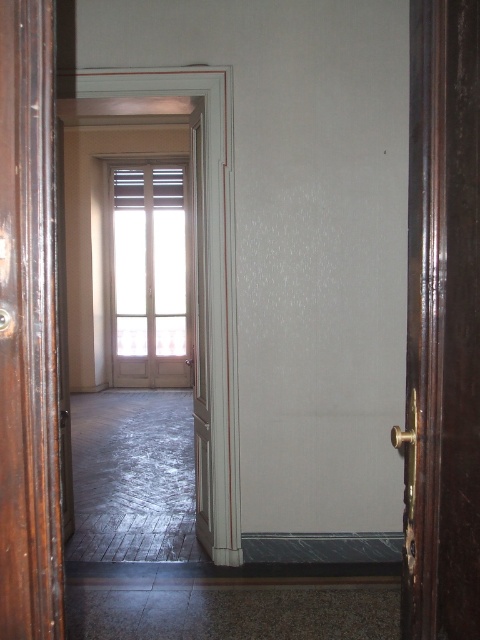
Does white wood window at center have a smaller size compared to white wooden door at center?

No, white wood window at center is not smaller than white wooden door at center.

Is white wood window at center wider than white wooden door at center?

Correct, the width of white wood window at center exceeds that of white wooden door at center.

Which is behind, point (159, 180) or point (194, 266)?

The point (159, 180) is behind.

This screenshot has height=640, width=480. I want to click on white wood window at center, so click(x=149, y=276).

The width and height of the screenshot is (480, 640). Describe the element at coordinates (28, 328) in the screenshot. I see `dark brown wooden door at left` at that location.

Is dark brown wooden door at left wider than white wood window at center?

No.

Does point (4, 305) come closer to viewer compared to point (130, 378)?

Yes.

Find the location of a particular element. This screenshot has height=640, width=480. dark brown wooden door at left is located at coordinates (28, 328).

Can you confirm if dark brown wooden door at left is smaller than white wooden door at center?

Yes, dark brown wooden door at left is smaller than white wooden door at center.

Is dark brown wooden door at left below white wooden door at center?

Indeed, dark brown wooden door at left is positioned under white wooden door at center.

Between point (50, 321) and point (197, 445), which one is positioned behind?

Positioned behind is point (197, 445).

The height and width of the screenshot is (640, 480). Find the location of `dark brown wooden door at left`. dark brown wooden door at left is located at coordinates (28, 328).